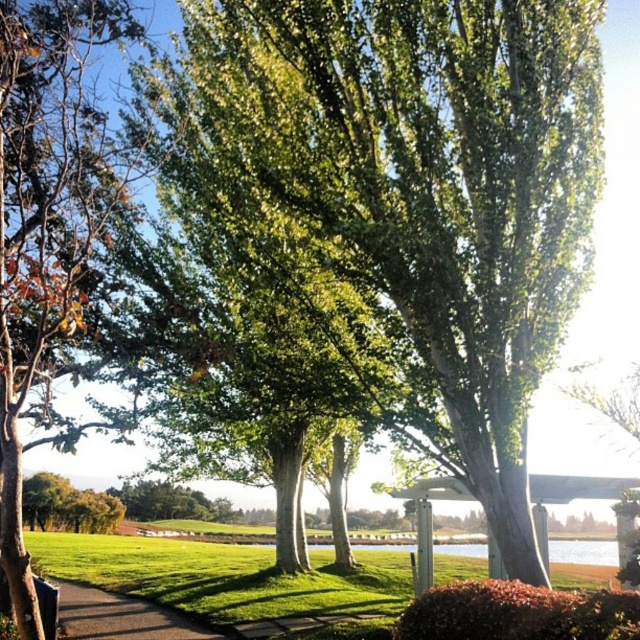
Which is behind, point (220, 172) or point (70, 292)?

Positioned behind is point (220, 172).

Who is higher up, green leafy tree at center or green leafy tree at left?

green leafy tree at left

Does point (538, 220) come closer to viewer compared to point (70, 6)?

No, it is behind (70, 6).

Where is `green leafy tree at center`? This screenshot has height=640, width=640. green leafy tree at center is located at coordinates (413, 202).

Does point (74, 20) lie behind point (90, 544)?

No.

Who is higher up, green leafy tree at left or green grass at lower center?

green leafy tree at left is above.

Find the location of a particular element. green leafy tree at left is located at coordinates (45, 221).

Who is positioned more to the right, green leafy tree at center or green grass at lower center?

From the viewer's perspective, green leafy tree at center appears more on the right side.

Is point (371, 371) positioned after point (289, 614)?

No, it is not.

Which is in front, point (305, 44) or point (586, 579)?

Point (305, 44) is in front.

What are the coordinates of `green leafy tree at center` in the screenshot? It's located at (413, 202).